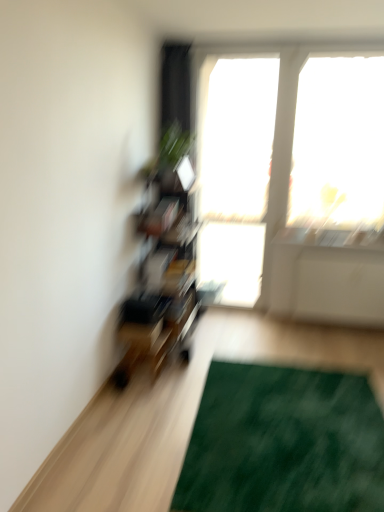
Where is `vacant region below green textured mat at lower right (from a real-world perspective)`? The width and height of the screenshot is (384, 512). vacant region below green textured mat at lower right (from a real-world perspective) is located at coordinates (278, 449).